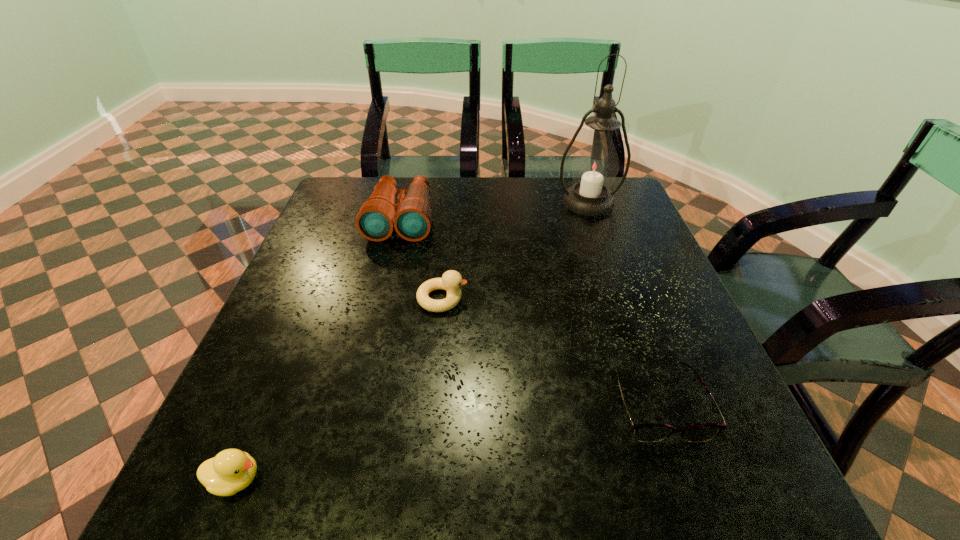
The image size is (960, 540). Identify the location of blank area in the image that satisfies the following two spatial constraints: 1. on the face of the shortest object; 2. on the beak of the nearer duckling. (685, 480).

Locate an element on the screen. This screenshot has width=960, height=540. vacant region that satisfies the following two spatial constraints: 1. through the lenses of the binoculars; 2. on the beak of the leftmost object is located at coordinates (339, 480).

The width and height of the screenshot is (960, 540). What are the coordinates of `vacant area that satisfies the following two spatial constraints: 1. on the face of the shortest object; 2. on the beak of the left duckling` in the screenshot? It's located at (685, 480).

Identify the location of vacant space that satisfies the following two spatial constraints: 1. on the face of the second nearest object; 2. on the beak of the leftmost object. (685, 480).

Where is `free location that satisfies the following two spatial constraints: 1. through the lenses of the fourth shortest object; 2. on the beak of the nearer duckling`? free location that satisfies the following two spatial constraints: 1. through the lenses of the fourth shortest object; 2. on the beak of the nearer duckling is located at coordinates (339, 480).